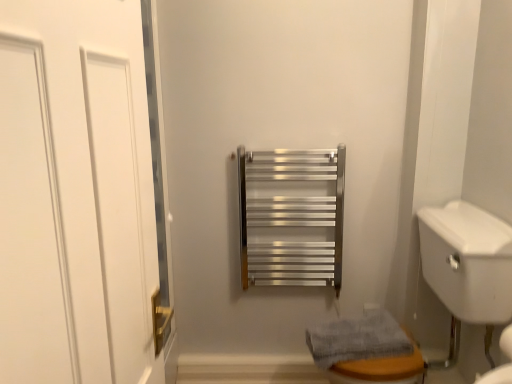
This screenshot has width=512, height=384. What do you see at coordinates (78, 193) in the screenshot?
I see `white matte door at left` at bounding box center [78, 193].

Describe the element at coordinates (467, 268) in the screenshot. The image size is (512, 384). I see `white glossy sink at lower right` at that location.

At what (x,y) coordinates should I click in order to perform the action: click on gray textured towel at lower right. Please return your answer as a coordinate pair (x, y). Looking at the image, I should click on (357, 339).

Can you see gray textured towel at lower right touching white glossy sink at lower right?

No, gray textured towel at lower right is not next to white glossy sink at lower right.

Could you tell me if gray textured towel at lower right is turned towards white glossy sink at lower right?

Yes.

Considering the relative positions of gray textured towel at lower right and white glossy sink at lower right in the image provided, is gray textured towel at lower right to the left of white glossy sink at lower right from the viewer's perspective?

Correct, you'll find gray textured towel at lower right to the left of white glossy sink at lower right.

The image size is (512, 384). Identify the location of sink above the gray textured towel at lower right (from the image's perspective). [467, 268].

At what (x,y) coordinates should I click in order to perform the action: click on sink lying in front of the gray textured towel at lower right. Please return your answer as a coordinate pair (x, y). The image size is (512, 384). Looking at the image, I should click on (467, 268).

Which of these two, white glossy sink at lower right or gray textured towel at lower right, is bigger?

Bigger between the two is white glossy sink at lower right.

Is point (459, 293) closer to camera compared to point (371, 318)?

Yes, point (459, 293) is in front of point (371, 318).

Is white glossy sink at lower right a part of white matte door at left?

No, white glossy sink at lower right is located outside of white matte door at left.

Is white matte door at left not close to white glossy sink at lower right?

white matte door at left is far away from white glossy sink at lower right.

Does white matte door at left have a greater width compared to white glossy sink at lower right?

In fact, white matte door at left might be narrower than white glossy sink at lower right.

Considering the positions of objects white glossy sink at lower right and white matte door at left in the image provided, who is in front, white glossy sink at lower right or white matte door at left?

white matte door at left is more forward.

Is white glossy sink at lower right wider than white matte door at left?

Indeed, white glossy sink at lower right has a greater width compared to white matte door at left.

From a real-world perspective, which is physically below, white glossy sink at lower right or white matte door at left?

white glossy sink at lower right.

Which of these two, gray textured towel at lower right or white matte door at left, is smaller?

white matte door at left.

Locate an element on the screen. This screenshot has width=512, height=384. bath towel to the right of white matte door at left is located at coordinates (357, 339).

Is gray textured towel at lower right positioned far away from white matte door at left?

Absolutely, gray textured towel at lower right is distant from white matte door at left.

From a real-world perspective, relative to gray textured towel at lower right, is white matte door at left vertically above or below?

In terms of real-world spatial position, white matte door at left is above gray textured towel at lower right.

Is white matte door at left situated inside gray textured towel at lower right or outside?

white matte door at left exists outside the volume of gray textured towel at lower right.

Find the location of a particular element. This screenshot has width=512, height=384. bath towel lying on the right of white matte door at left is located at coordinates (357, 339).

I want to click on bath towel located behind the white glossy sink at lower right, so click(357, 339).

You are a GUI agent. You are given a task and a screenshot of the screen. Output one action in this format:
    pyautogui.click(x=<x>, y=<y>)
    Task: Click on the bath towel below the white glossy sink at lower right (from a real-world perspective)
    This screenshot has height=384, width=512.
    Given the screenshot: What is the action you would take?
    pyautogui.click(x=357, y=339)

Looking at the image, which one is located further to white matte door at left, gray textured towel at lower right or white glossy sink at lower right?

white glossy sink at lower right is further to white matte door at left.

Estimate the real-world distances between objects in this image. Which object is closer to white glossy sink at lower right, gray textured towel at lower right or white matte door at left?

gray textured towel at lower right lies closer to white glossy sink at lower right than the other object.

Estimate the real-world distances between objects in this image. Which object is further from gray textured towel at lower right, white glossy sink at lower right or white matte door at left?

white matte door at left lies further to gray textured towel at lower right than the other object.

When comparing their distances from gray textured towel at lower right, does white matte door at left or white glossy sink at lower right seem closer?

white glossy sink at lower right is closer to gray textured towel at lower right.

Considering their positions, is white glossy sink at lower right positioned further to white matte door at left than gray textured towel at lower right?

Based on the image, white glossy sink at lower right appears to be further to white matte door at left.

Which object lies nearer to the anchor point white glossy sink at lower right, white matte door at left or gray textured towel at lower right?

Based on the image, gray textured towel at lower right appears to be nearer to white glossy sink at lower right.

Locate an element on the screen. The image size is (512, 384). sink between white matte door at left and gray textured towel at lower right in the front-back direction is located at coordinates (467, 268).